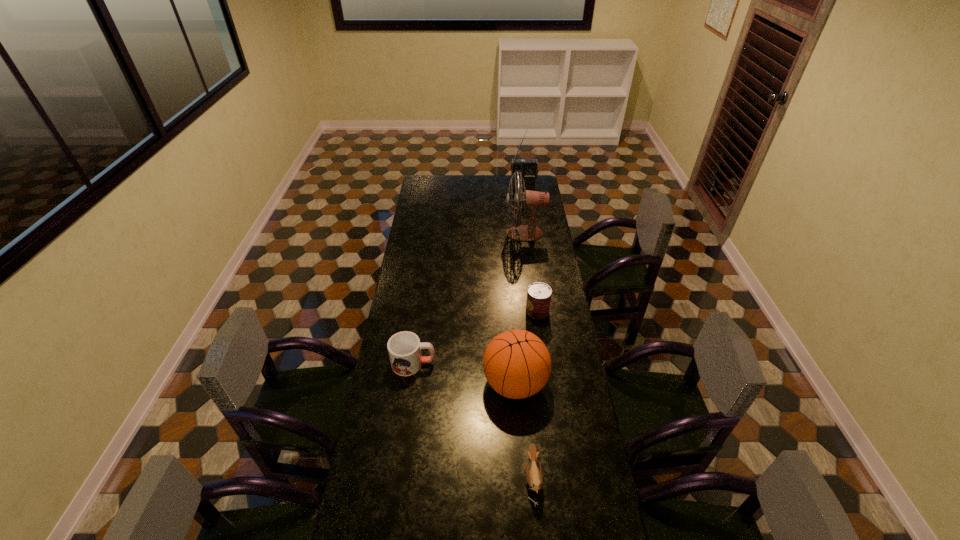
The image size is (960, 540). Find the location of `vacant space in between the can and the farthest object`. vacant space in between the can and the farthest object is located at coordinates (530, 249).

The width and height of the screenshot is (960, 540). In order to click on free space between the mug and the basketball in this screenshot , I will do `click(465, 373)`.

Locate an element on the screen. empty space that is in between the leftmost object and the nearest object is located at coordinates (473, 421).

Where is `free space that is in between the mug and the fifth nearest object`? Image resolution: width=960 pixels, height=540 pixels. free space that is in between the mug and the fifth nearest object is located at coordinates (469, 299).

Locate an element on the screen. Image resolution: width=960 pixels, height=540 pixels. free space between the fifth nearest object and the leftmost object is located at coordinates (469, 299).

Image resolution: width=960 pixels, height=540 pixels. Find the location of `free space that is in between the fan and the fourth shortest object`. free space that is in between the fan and the fourth shortest object is located at coordinates (520, 308).

The height and width of the screenshot is (540, 960). Find the location of `object that can be found as the third closest to the third farthest object`. object that can be found as the third closest to the third farthest object is located at coordinates (404, 348).

Identify which object is located as the second nearest to the third tallest object. Please provide its 2D coordinates. Your answer should be formatted as a tuple, i.e. [(x, y)], where the tuple contains the x and y coordinates of a point satisfying the conditions above.

[(404, 348)]

Where is `free spot that satisfies the following two spatial constraints: 1. in front of the can to direct airflow; 2. on the right side of the second farthest object`? Image resolution: width=960 pixels, height=540 pixels. free spot that satisfies the following two spatial constraints: 1. in front of the can to direct airflow; 2. on the right side of the second farthest object is located at coordinates (535, 311).

This screenshot has width=960, height=540. What are the coordinates of `free space that satisfies the following two spatial constraints: 1. on the display of the radio receiver; 2. in front of the fan to direct airflow` in the screenshot? It's located at (530, 233).